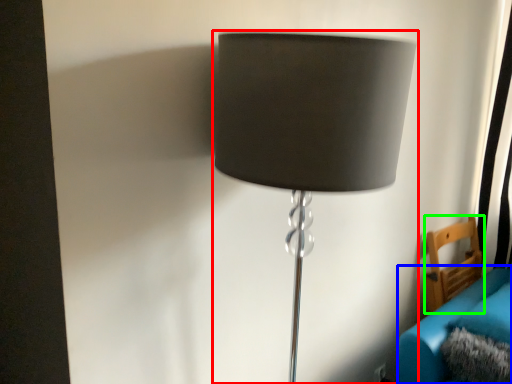
Question: Based on their relative distances, which object is nearer to lamp (highlighted by a red box)? Choose from couch (highlighted by a blue box) and furniture (highlighted by a green box).

Choices:
 (A) couch
 (B) furniture

Answer: (A)